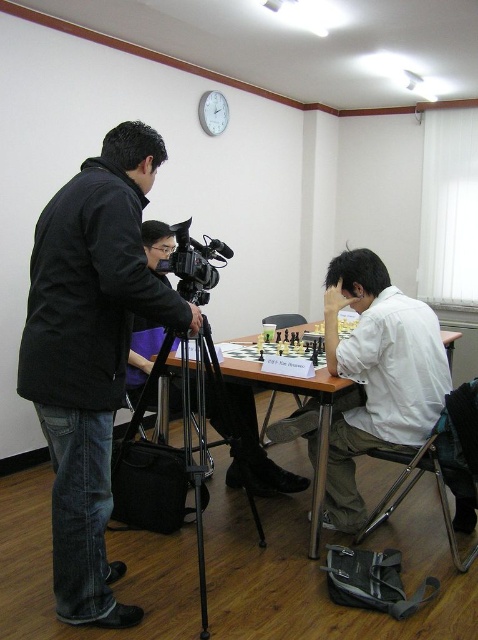
You are a photographer who needs to adjust the camera focus. The black matte jacket at left and white matte shirt at center are in your frame. Based on their distance, can you estimate if both subjects will be in focus simultaneously?

The distance between the black matte jacket at left and white matte shirt at center is 3.41 feet. Depending on the camera settings, if the depth of field is sufficient to cover this distance, both subjects can be in focus. However, if the depth of field is narrow, only one subject may be in focus at a time.

You are a photographer in the room and you want to take a picture of the wooden at center without the black matte jacket at left blocking the view. What should you do?

Move the camera to the right side so that the black matte jacket at left is no longer in front of the wooden at center.

You are setting up a camera in the room. You need to position the camera so that both the black matte jacket at left and the wooden at center are visible in the frame. Based on their positions, which object should be closer to the left edge of the camera frame?

The black matte jacket at left is to the left of wooden at center, so the black matte jacket at left should be closer to the left edge of the camera frame.